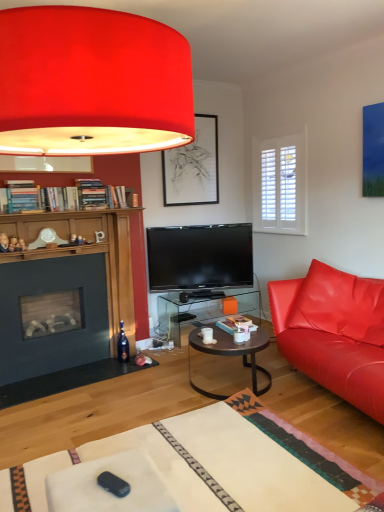
This screenshot has width=384, height=512. I want to click on free space to the back side of black plastic remote control at lower center, so click(130, 465).